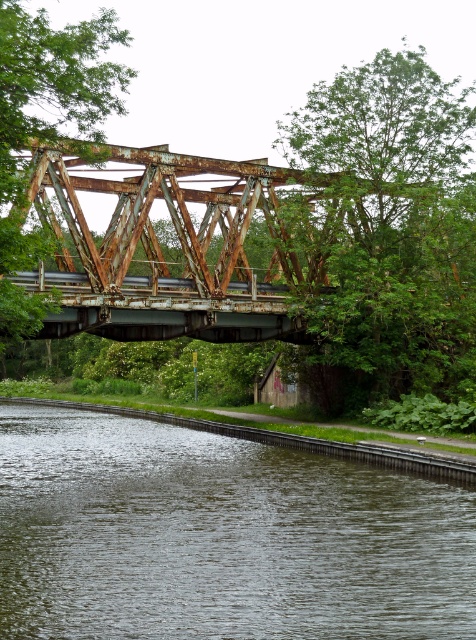
Looking at this image, you are standing on the metal truss bridge and notice a point marked at coordinates (x=219, y=538). What is located at that point?

The point at coordinates (x=219, y=538) marks dark green water at lower left.

You are a photographer standing on the bridge and want to capture a photo of the dark green water at lower left and the green leafy tree at upper right. Which object will appear closer to the camera in the photo?

The dark green water at lower left is in front of the green leafy tree at upper right, so it will appear closer to the camera in the photo.